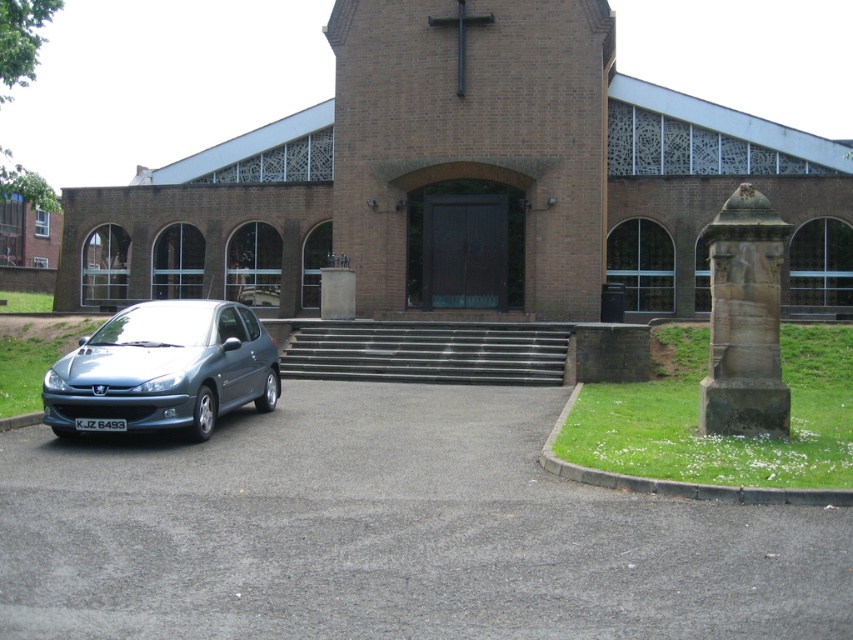
You are a photographer planning to take a photo of the brick church at center and the satin metallic car at lower left from a distance. Which object will appear taller in the photo?

The brick church at center will appear taller in the photo because it has a greater height compared to the satin metallic car at lower left.

You are standing at the coordinates 0.5, 0.5 in the image. You want to walk directly towards the brick church at center. In which direction should you move?

Since the brick church at center is located at point [462,179] and you are at [426,320], you should move to the left and slightly downward to reach it.